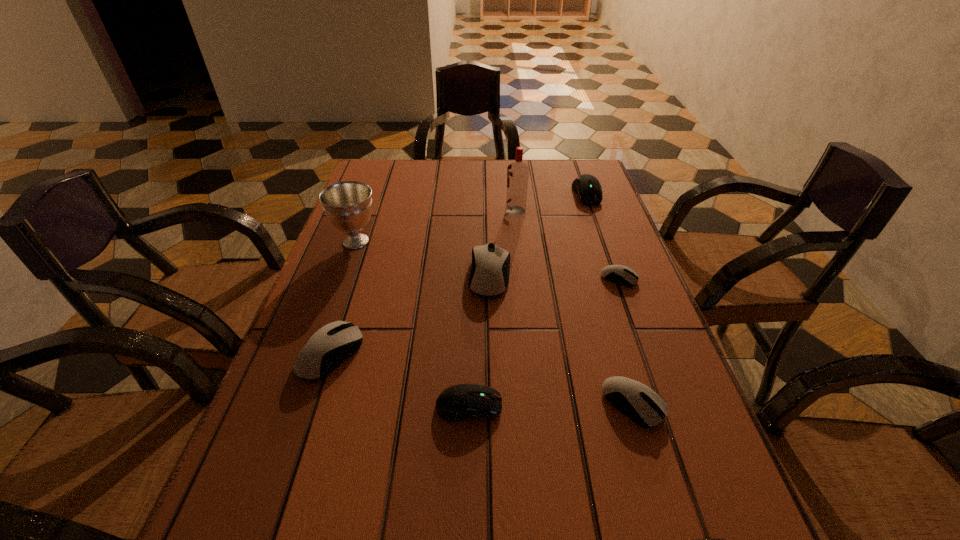
Identify the location of the leftmost dark computer equipment. (459, 402).

Where is `the second farthest dark computer equipment`? This screenshot has height=540, width=960. the second farthest dark computer equipment is located at coordinates (459, 402).

The image size is (960, 540). Find the location of `the smallest white mouse`. the smallest white mouse is located at coordinates (623, 275).

Identify the location of vacant space situated 0.280m on the front label of the red vodka. (410, 211).

Where is `free spot located on the front label of the red vodka`? The height and width of the screenshot is (540, 960). free spot located on the front label of the red vodka is located at coordinates (420, 211).

Locate an element on the screen. The height and width of the screenshot is (540, 960). blank space located 0.210m on the front label of the red vodka is located at coordinates (433, 211).

Locate an element on the screen. vacant space positioned 0.050m on the front of the second tallest object is located at coordinates (347, 269).

You are a GUI agent. You are given a task and a screenshot of the screen. Output one action in this format:
    pyautogui.click(x=<x>, y=<y>)
    Task: Click on the free space located on the back of the tallest computer equipment
    The image size is (960, 540).
    Given the screenshot: What is the action you would take?
    coord(488,199)

Where is `free location located on the back of the leftmost computer equipment`? The image size is (960, 540). free location located on the back of the leftmost computer equipment is located at coordinates (352, 287).

Find the location of `vacant space located on the button of the farthest dark computer equipment`. vacant space located on the button of the farthest dark computer equipment is located at coordinates (624, 297).